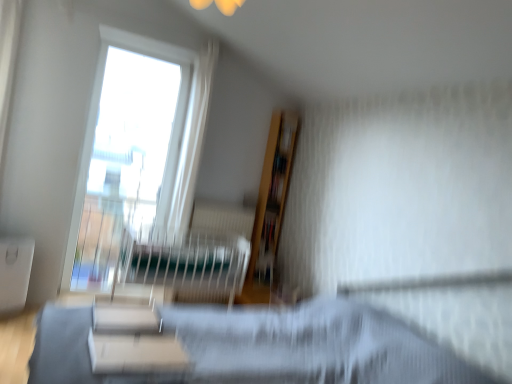
Locate an element on the screen. free space above white matte table at lower center, placed as the first table when sorted from right to left (from a real-world perspective) is located at coordinates (143, 348).